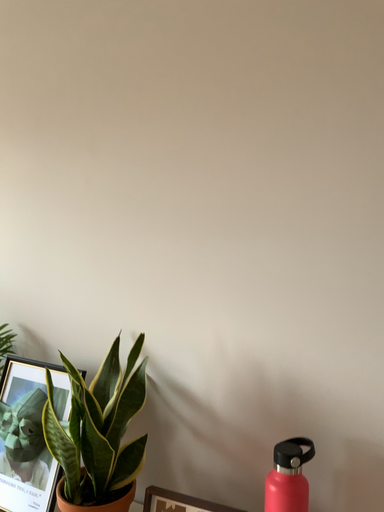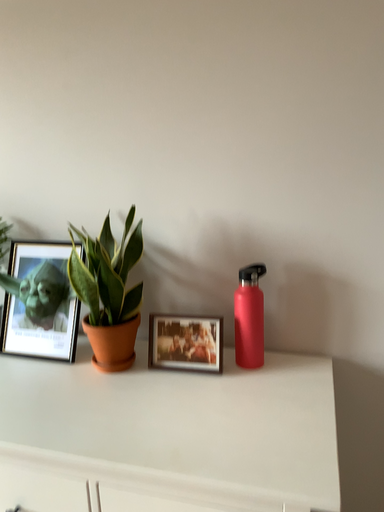
Question: Which way did the camera rotate in the video?

Choices:
 (A) rotated upward
 (B) rotated downward

Answer: (B)